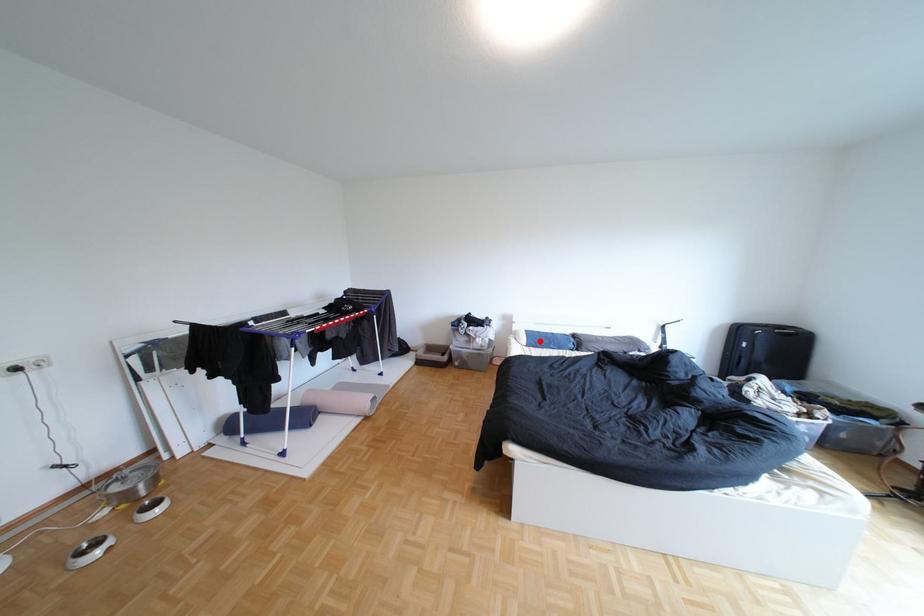
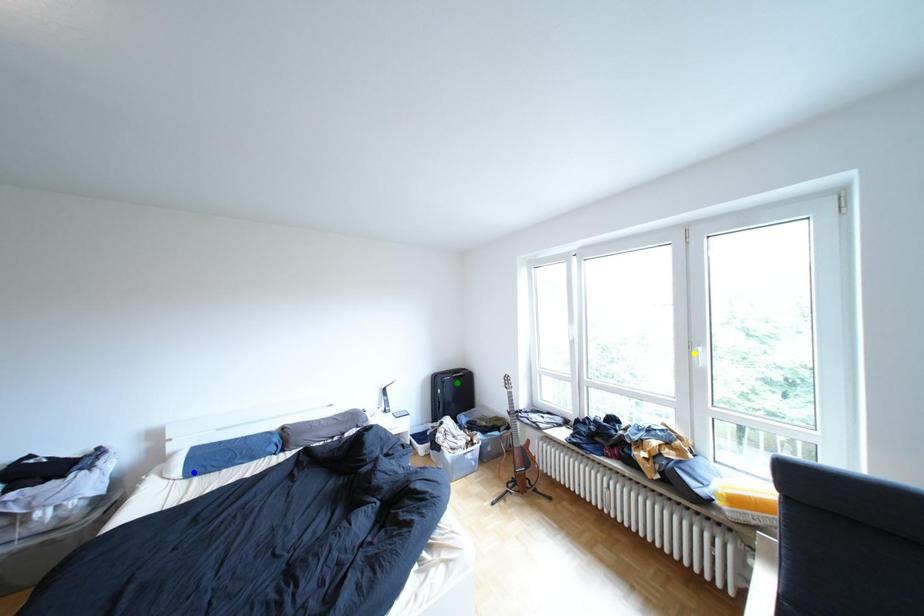
Question: I am providing you with two images of the same scene from different viewpoints. A red point is marked on the first image. You are given multiple points on the second image. Which point in image 2 is actually the same real-world point as the red point in image 1?

Choices:
 (A) green point
 (B) yellow point
 (C) blue point

Answer: (C)